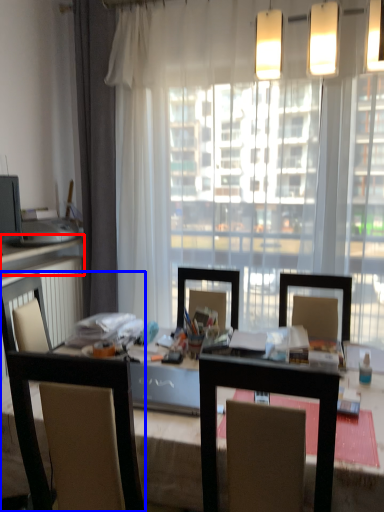
Question: Which object is closer to the camera taking this photo, counter top (highlighted by a red box) or chair (highlighted by a blue box)?

Choices:
 (A) counter top
 (B) chair

Answer: (B)